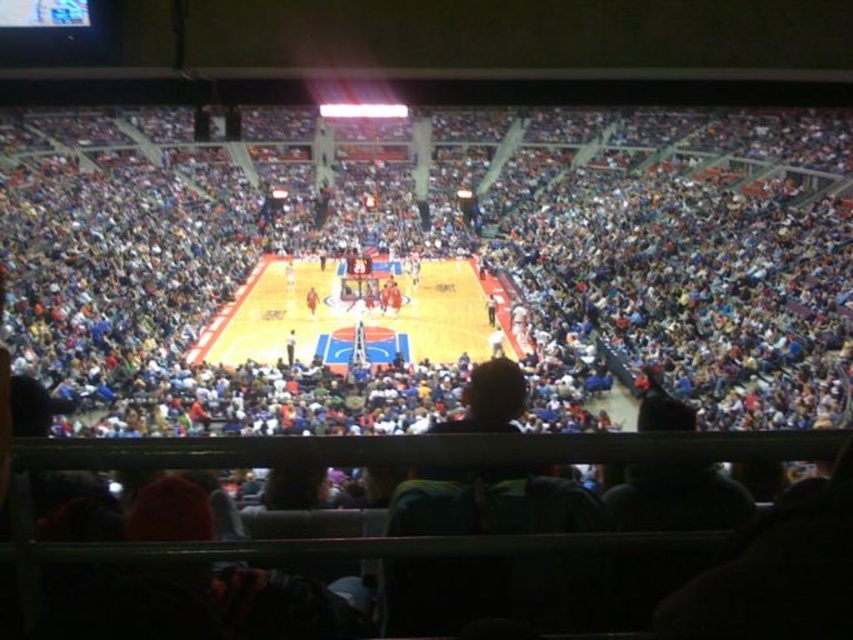
Which of these two, wooden basketball court at center or orange jersey at center, stands taller?

With more height is wooden basketball court at center.

In the scene shown: Which is below, wooden basketball court at center or orange jersey at center?

Positioned lower is orange jersey at center.

Locate an element on the screen. The width and height of the screenshot is (853, 640). wooden basketball court at center is located at coordinates (357, 316).